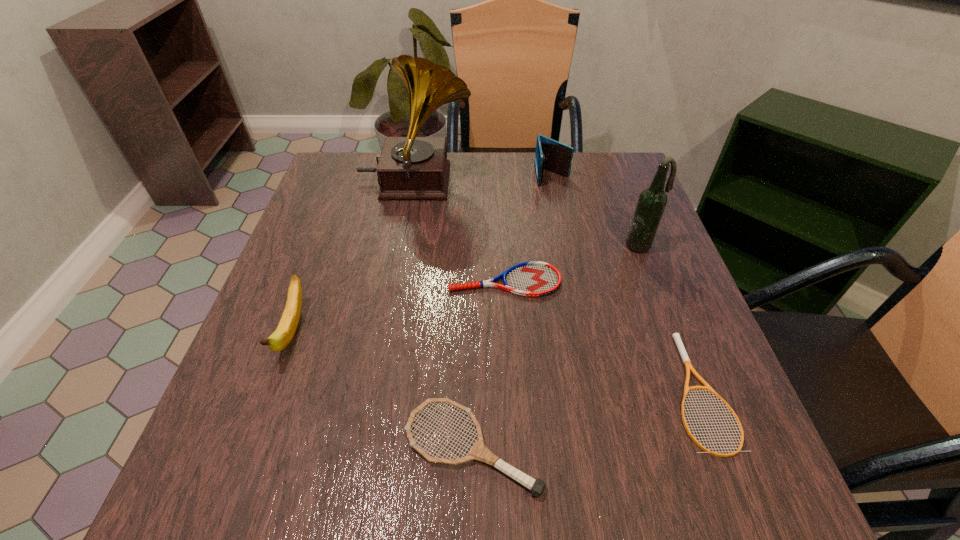
This screenshot has width=960, height=540. Find the location of `beer bottle that is at the right edge`. beer bottle that is at the right edge is located at coordinates (652, 201).

What are the coordinates of `tennis racket that is at the right edge` in the screenshot? It's located at (676, 336).

Where is `object situated at the far left corner`? The image size is (960, 540). object situated at the far left corner is located at coordinates (411, 167).

The width and height of the screenshot is (960, 540). I want to click on object at the near right corner, so click(676, 336).

Locate an element on the screen. vacant region at the far edge of the desktop is located at coordinates (568, 195).

Where is `vacant region at the near edge of the desktop`? The height and width of the screenshot is (540, 960). vacant region at the near edge of the desktop is located at coordinates (347, 484).

Image resolution: width=960 pixels, height=540 pixels. Find the location of `free point at the left edge`. free point at the left edge is located at coordinates (295, 390).

You are a GUI agent. You are given a task and a screenshot of the screen. Output one action in this format:
    pyautogui.click(x=<x>, y=<y>)
    Task: Click on the free space at the right edge
    Image resolution: width=960 pixels, height=540 pixels.
    Given the screenshot: What is the action you would take?
    pyautogui.click(x=675, y=298)

Locate an element on the screen. Image resolution: width=960 pixels, height=540 pixels. vacant area at the far left corner of the desktop is located at coordinates (321, 189).

In the image, there is a desktop. Where is `blank space at the near left corner`? Image resolution: width=960 pixels, height=540 pixels. blank space at the near left corner is located at coordinates (258, 481).